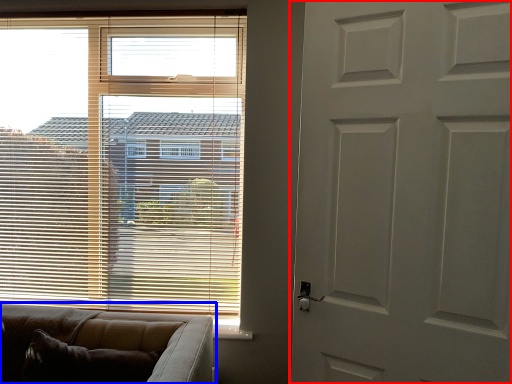
Question: Among these objects, which one is nearest to the camera, door (highlighted by a red box) or studio couch (highlighted by a blue box)?

Choices:
 (A) door
 (B) studio couch

Answer: (A)